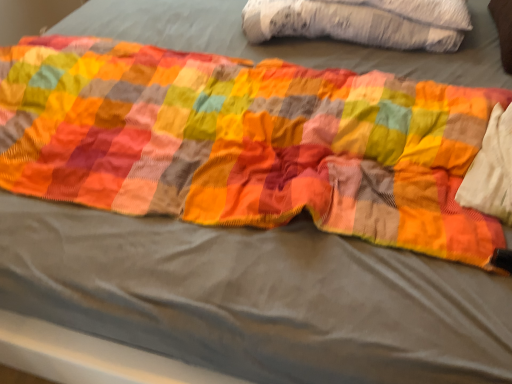
Identify the location of white textured pillow at upper center. The width and height of the screenshot is (512, 384). (362, 22).

The image size is (512, 384). What do you see at coordinates (362, 22) in the screenshot? I see `white textured pillow at upper center` at bounding box center [362, 22].

Locate an element on the screen. white textured pillow at upper center is located at coordinates (362, 22).